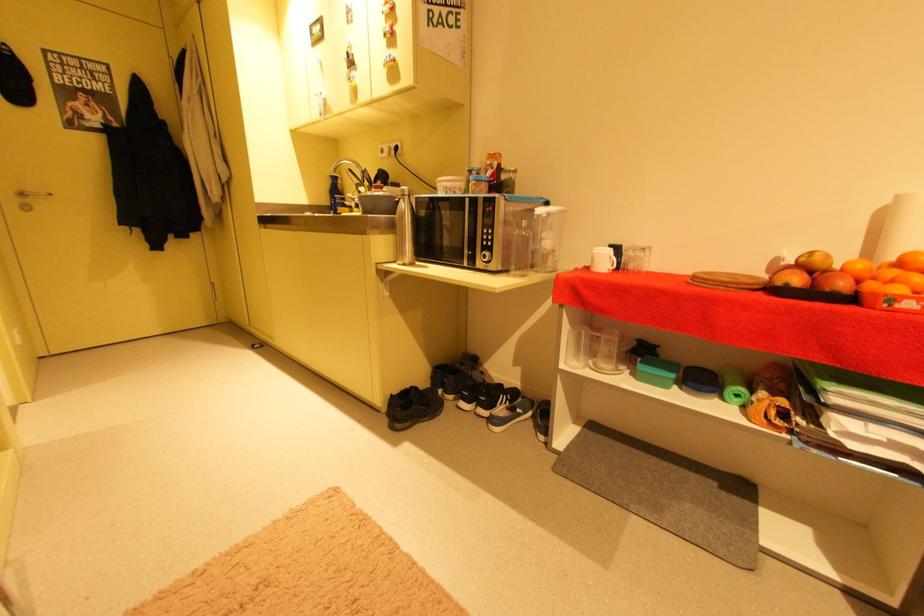
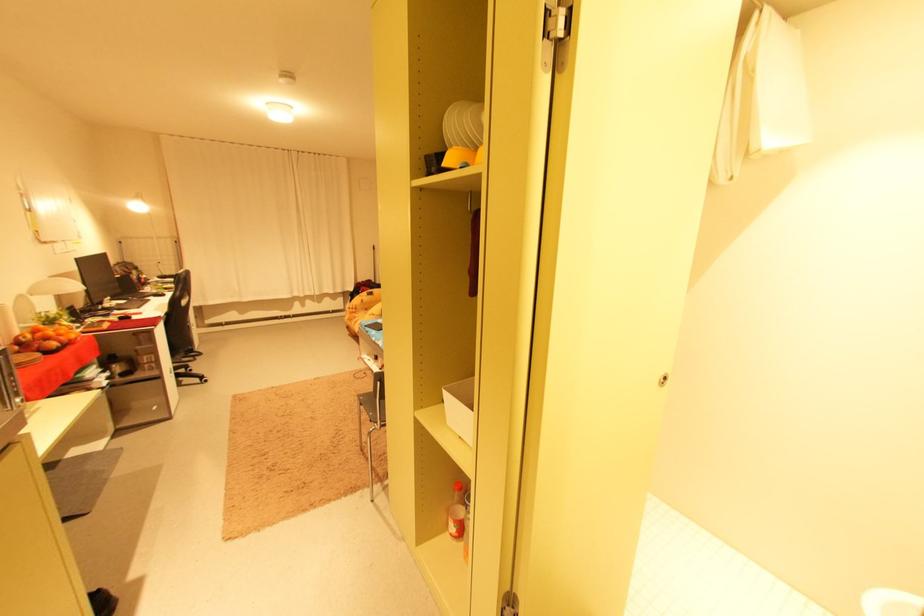
In the second image, find the point that corresponds to point (822, 286) in the first image.

(68, 344)